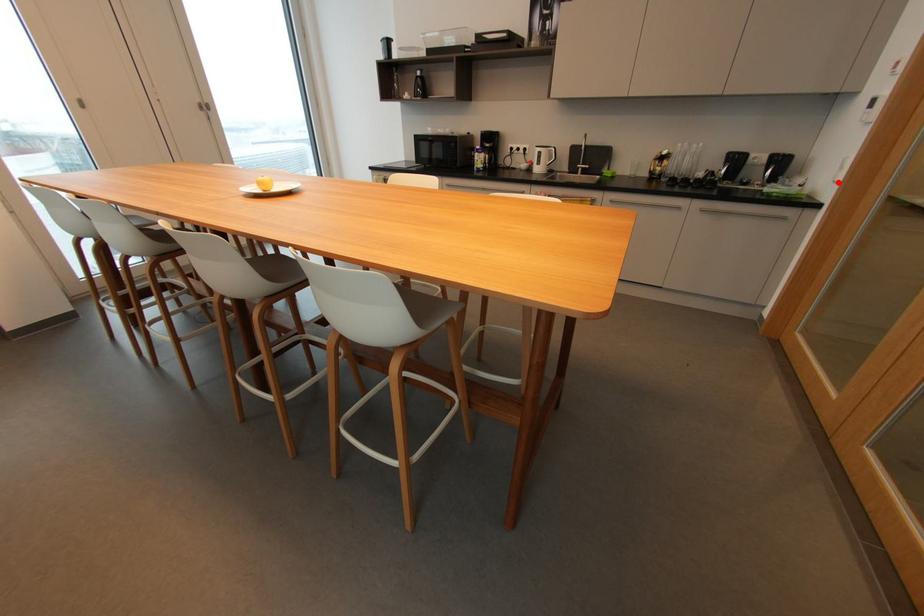
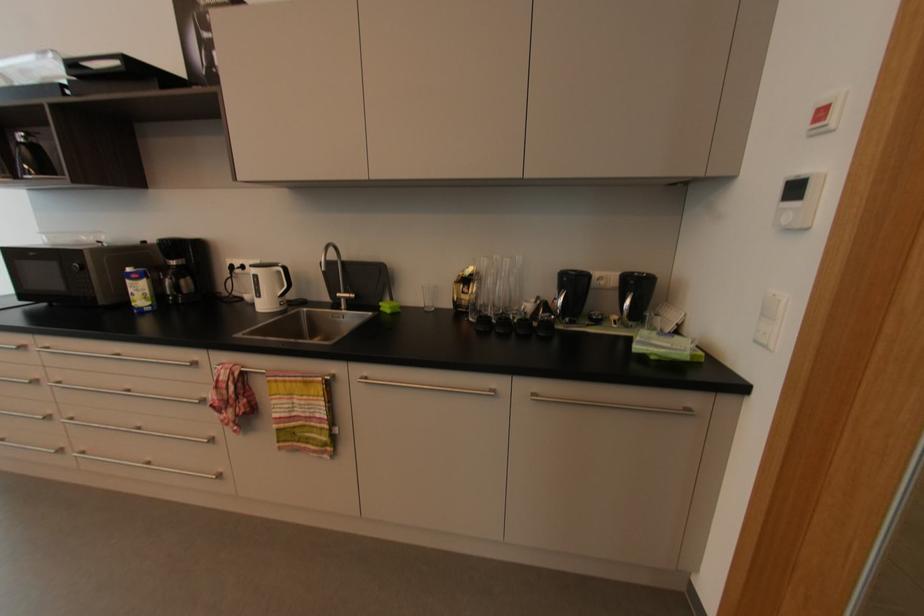
Question: I am providing you with two images of the same scene from different viewpoints. Image1 has a red point marked. In image2, the corresponding 3D location appears at what relative position? Reply with the corresponding letter.

Choices:
 (A) Closer
 (B) Farther

Answer: (A)